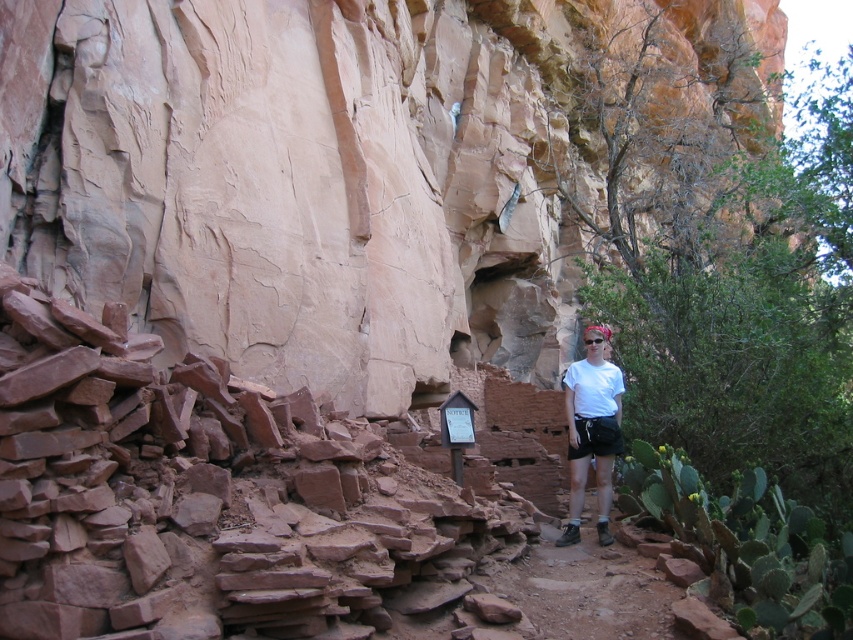
You are an explorer navigating a rugged canyon with red rock formations. You see a point marked at coordinates (202,493). What object is located at that point?

The rustic stone rubble at center left is located at point (202,493).

You are a photographer standing at the edge of the canyon looking at the cliff face. You want to capture both the point at coordinates point (329, 554) and point (607, 429) in your photo. Which point will appear larger in your photo?

Point (329, 554) is closer to the camera than point (607, 429), so it will appear larger in the photo.